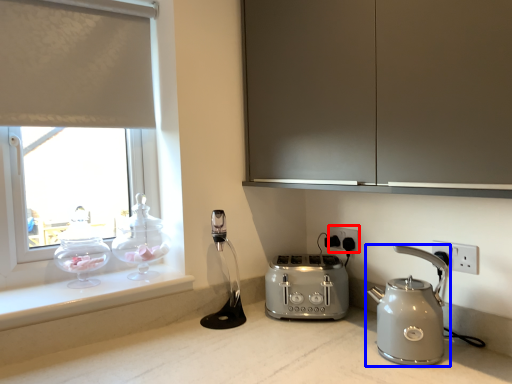
Question: Which object is closer to the camera taking this photo, electric outlet (highlighted by a red box) or kettle (highlighted by a blue box)?

Choices:
 (A) electric outlet
 (B) kettle

Answer: (B)